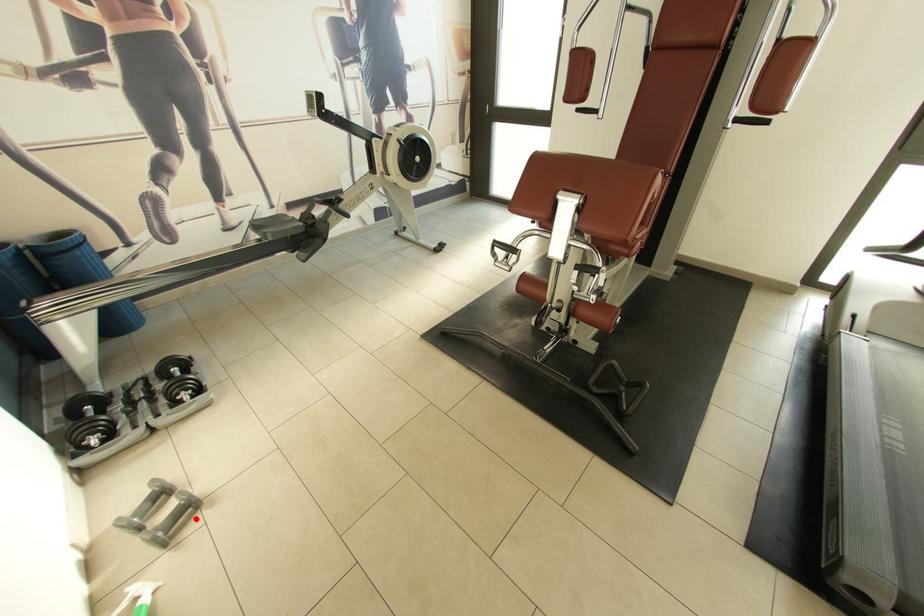
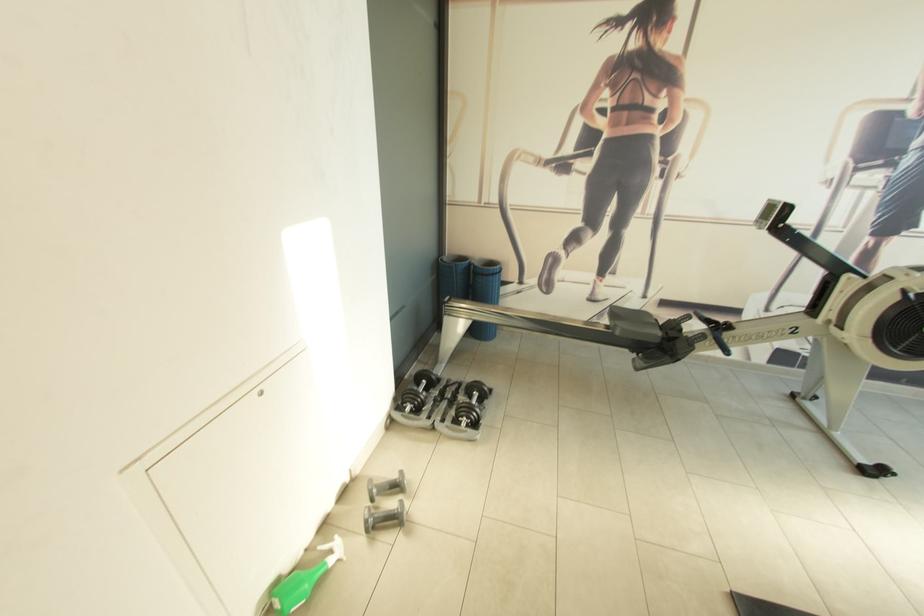
Where in the second image is the point corresponding to the highlighted location from the first image?

(397, 528)